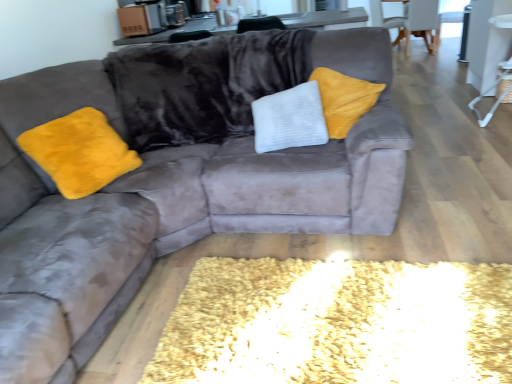
Question: Are white plastic side table at right and white fabric armchair at upper right, the 1th armchair from the front, beside each other?

Choices:
 (A) no
 (B) yes

Answer: (A)

Question: Is white plastic side table at right facing away from white fabric armchair at upper right, the second armchair when ordered from back to front?

Choices:
 (A) no
 (B) yes

Answer: (A)

Question: Does white plastic side table at right have a greater width compared to white fabric armchair at upper right, the 1th armchair from the front?

Choices:
 (A) no
 (B) yes

Answer: (A)

Question: Is white plastic side table at right oriented towards white fabric armchair at upper right, the 1th armchair from the front?

Choices:
 (A) yes
 (B) no

Answer: (B)

Question: Would you say white plastic side table at right contains white fabric armchair at upper right, the 1th armchair from the front?

Choices:
 (A) no
 (B) yes

Answer: (A)

Question: From the image's perspective, would you say white plastic side table at right is positioned over white fabric armchair at upper right, the second armchair when ordered from back to front?

Choices:
 (A) no
 (B) yes

Answer: (A)

Question: Considering the relative sizes of velvet gray armchair at upper right, arranged as the 2th armchair when viewed from the front, and white plastic side table at right in the image provided, is velvet gray armchair at upper right, arranged as the 2th armchair when viewed from the front, taller than white plastic side table at right?

Choices:
 (A) no
 (B) yes

Answer: (A)

Question: Is velvet gray armchair at upper right, which appears as the 1th armchair when viewed from the back, closer to the viewer compared to white plastic side table at right?

Choices:
 (A) yes
 (B) no

Answer: (B)

Question: Is velvet gray armchair at upper right, arranged as the 2th armchair when viewed from the front, thinner than white plastic side table at right?

Choices:
 (A) yes
 (B) no

Answer: (B)

Question: Does velvet gray armchair at upper right, which appears as the 1th armchair when viewed from the back, appear on the right side of white plastic side table at right?

Choices:
 (A) no
 (B) yes

Answer: (B)

Question: Considering the relative positions of velvet gray armchair at upper right, arranged as the 2th armchair when viewed from the front, and white plastic side table at right in the image provided, is velvet gray armchair at upper right, arranged as the 2th armchair when viewed from the front, to the left of white plastic side table at right from the viewer's perspective?

Choices:
 (A) no
 (B) yes

Answer: (A)

Question: Could you tell me if velvet gray armchair at upper right, which appears as the 1th armchair when viewed from the back, is turned towards white plastic side table at right?

Choices:
 (A) yes
 (B) no

Answer: (B)

Question: Can you confirm if white plastic side table at right is smaller than velvet gray armchair at upper right, arranged as the 2th armchair when viewed from the front?

Choices:
 (A) no
 (B) yes

Answer: (B)